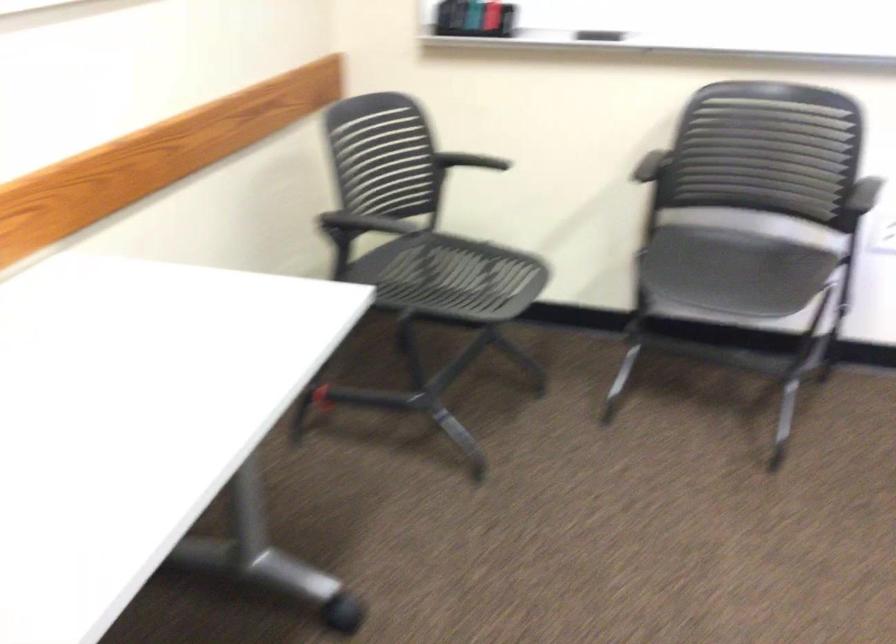
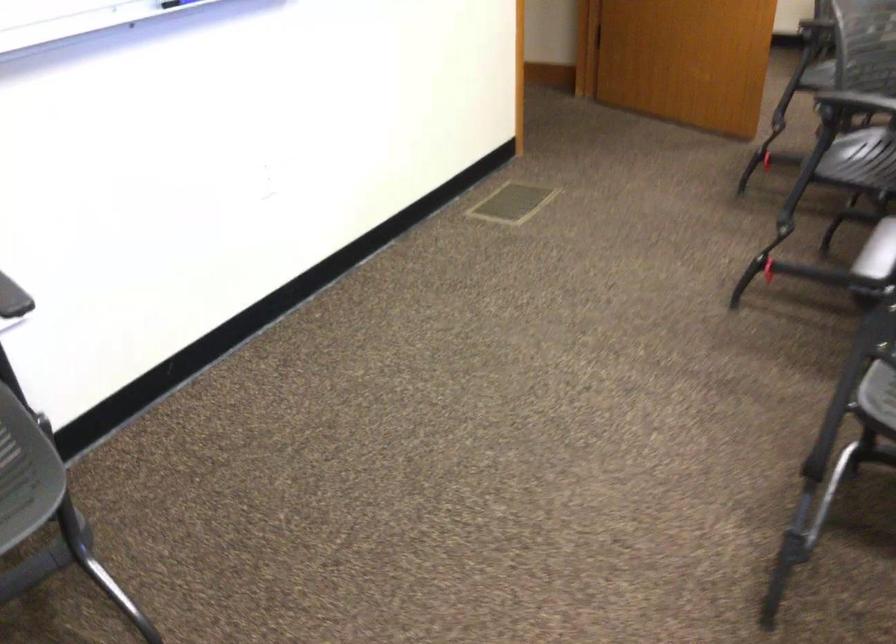
Where in the second image is the point corresponding to point 782,301 from the first image?

(26, 473)